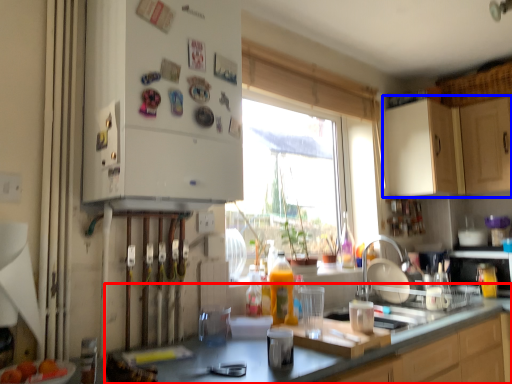
Question: Which object appears closest to the camera in this image, countertop (highlighted by a red box) or cabinetry (highlighted by a blue box)?

Choices:
 (A) countertop
 (B) cabinetry

Answer: (A)